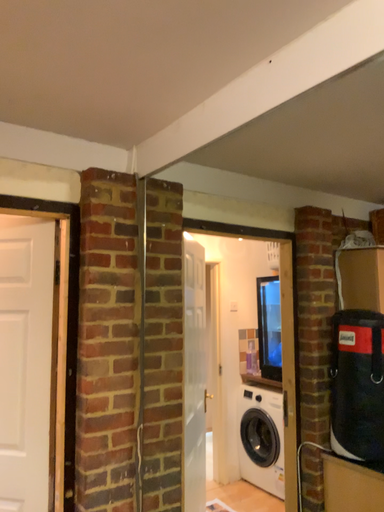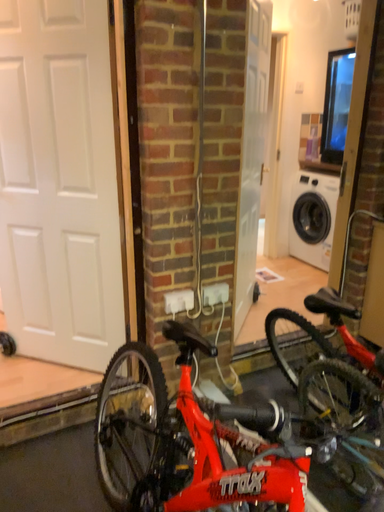
Question: Which way did the camera rotate in the video?

Choices:
 (A) rotated right
 (B) rotated left

Answer: (B)